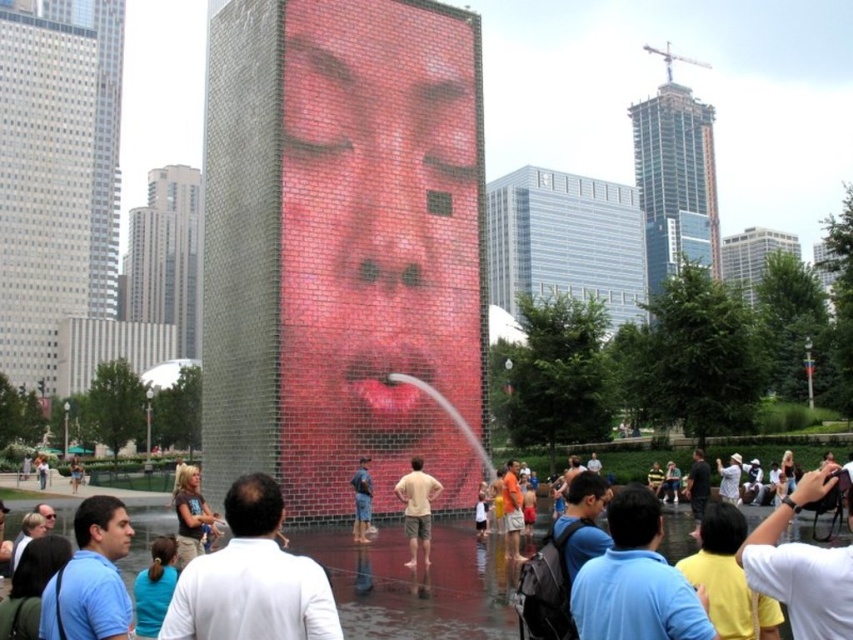
You are a photographer standing in front of the fountain. You want to capture a photo where both the denim shorts at center and the smooth skin face at center are clearly visible. Considering their sizes, which object should you focus on first to ensure both are in frame?

The denim shorts at center is smaller than the smooth skin face at center. To ensure both are in frame, focus on the larger smooth skin face at center first, then adjust the camera angle to include the smaller denim shorts at center.